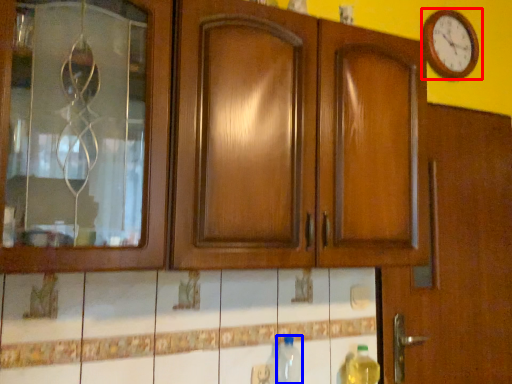
Question: Among these objects, which one is nearest to the camera, wall clock (highlighted by a red box) or bottle (highlighted by a blue box)?

Choices:
 (A) wall clock
 (B) bottle

Answer: (B)